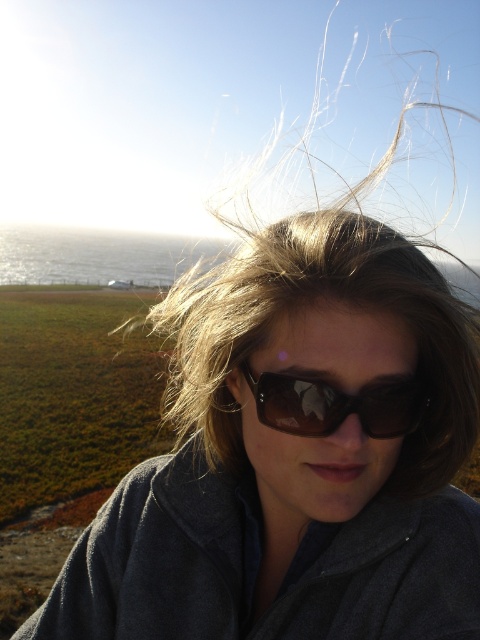
You are a photographer trying to capture the person in the scene. Since the subject is facing the sunlight, you need to adjust the camera to avoid glare from the brown reflective sunglasses at center. However, the blonde hair at center might also be reflecting light. Which object is closer to the camera to potentially cause more glare?

The brown reflective sunglasses at center are positioned above the blonde hair at center, so they are closer to the camera and would likely cause more glare.

You are a photographer trying to capture a closeup shot of the person in the scene. You want to ensure that both the blonde hair at center and the brown reflective sunglasses at center are clearly visible in the frame. Given their sizes, which object should you focus on to ensure both are in focus?

The blonde hair at center is narrower than the brown reflective sunglasses at center, so focusing on the sunglasses would ensure both are in focus since the depth of field would cover the wider object first.

You are a photographer trying to capture a portrait of the person in the scene. You need to ensure that the subject is well framed so that the blonde hair at center and brown reflective sunglasses at center are both visible. Based on their relative sizes in the image, which object should you focus on to ensure both are in frame?

The blonde hair at center is much taller than the brown reflective sunglasses at center, so focusing on the taller blonde hair at center will ensure both are in frame.